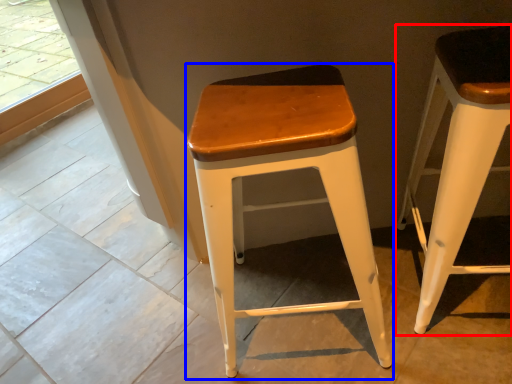
Question: Which of the following is the closest to the observer, stool (highlighted by a red box) or stool (highlighted by a blue box)?

Choices:
 (A) stool
 (B) stool

Answer: (A)